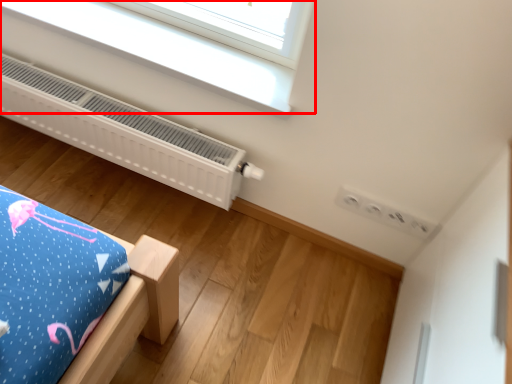
Question: From the image's perspective, where is window (annotated by the red box) located relative to heater?

Choices:
 (A) below
 (B) above

Answer: (B)